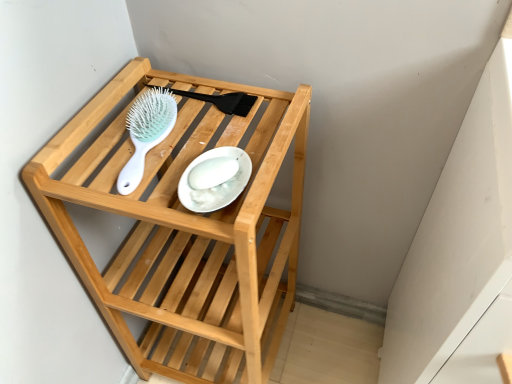
Question: Is light blue plastic hairbrush at upper center facing towards white glossy plate at center?

Choices:
 (A) yes
 (B) no

Answer: (B)

Question: From a real-world perspective, is light blue plastic hairbrush at upper center below white glossy plate at center?

Choices:
 (A) yes
 (B) no

Answer: (A)

Question: Considering the relative positions of light blue plastic hairbrush at upper center and white glossy plate at center in the image provided, is light blue plastic hairbrush at upper center to the left of white glossy plate at center from the viewer's perspective?

Choices:
 (A) no
 (B) yes

Answer: (B)

Question: Does light blue plastic hairbrush at upper center have a lesser width compared to white glossy plate at center?

Choices:
 (A) yes
 (B) no

Answer: (B)

Question: Is light blue plastic hairbrush at upper center shorter than white glossy plate at center?

Choices:
 (A) no
 (B) yes

Answer: (A)

Question: Considering the positions of point (296, 145) and point (182, 200), is point (296, 145) closer or farther from the camera than point (182, 200)?

Choices:
 (A) closer
 (B) farther

Answer: (B)

Question: In terms of width, does natural wood shelf at center look wider or thinner when compared to white glossy plate at center?

Choices:
 (A) wide
 (B) thin

Answer: (A)

Question: From a real-world perspective, is natural wood shelf at center physically located above or below white glossy plate at center?

Choices:
 (A) above
 (B) below

Answer: (B)

Question: From the image's perspective, is natural wood shelf at center located above or below white glossy plate at center?

Choices:
 (A) below
 (B) above

Answer: (A)

Question: From the image's perspective, is white glossy plate at center located above or below natural wood shelf at center?

Choices:
 (A) below
 (B) above

Answer: (B)

Question: Based on their sizes in the image, would you say white glossy plate at center is bigger or smaller than natural wood shelf at center?

Choices:
 (A) big
 (B) small

Answer: (B)

Question: Considering their positions, is white glossy plate at center located in front of or behind natural wood shelf at center?

Choices:
 (A) front
 (B) behind

Answer: (B)

Question: In terms of width, does white glossy plate at center look wider or thinner when compared to natural wood shelf at center?

Choices:
 (A) wide
 (B) thin

Answer: (B)

Question: Is white glossy plate at center wider or thinner than light blue plastic hairbrush at upper center?

Choices:
 (A) thin
 (B) wide

Answer: (A)

Question: Is white glossy plate at center to the left or to the right of light blue plastic hairbrush at upper center in the image?

Choices:
 (A) right
 (B) left

Answer: (A)